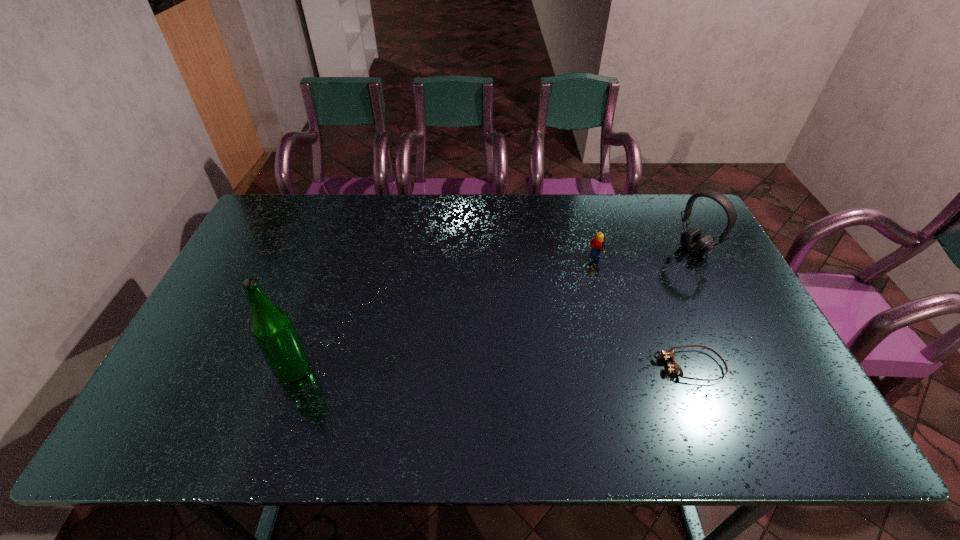
Where is `vacant space on the desktop that is between the beer bottle and the second object from right to left and is positioned on the front-facing side of the third shortest object`? The height and width of the screenshot is (540, 960). vacant space on the desktop that is between the beer bottle and the second object from right to left and is positioned on the front-facing side of the third shortest object is located at coordinates (505, 368).

This screenshot has width=960, height=540. I want to click on free space on the desktop that is between the leftmost object and the shortest object and is positioned on the front-facing side of the third tallest object, so click(547, 367).